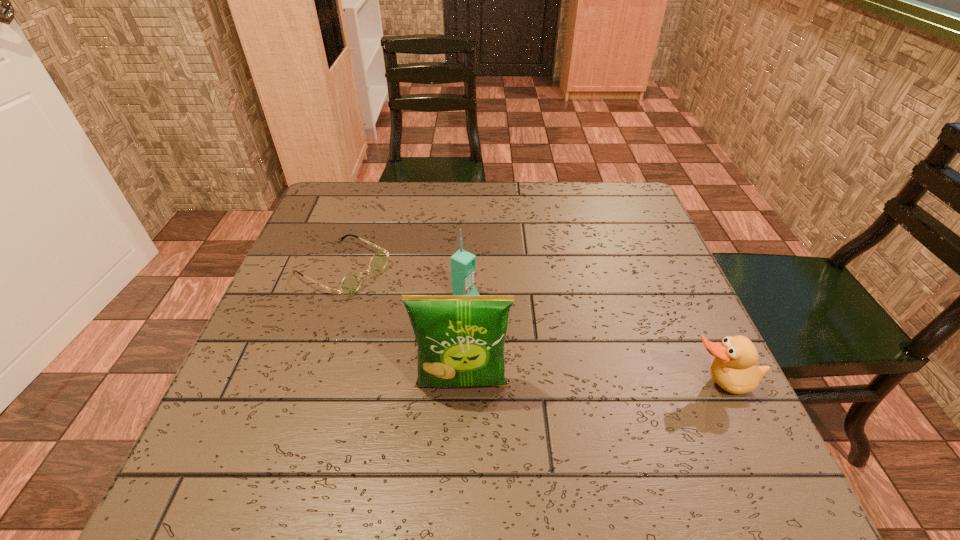
The height and width of the screenshot is (540, 960). Find the location of `free region at the left edge of the desktop`. free region at the left edge of the desktop is located at coordinates (316, 267).

Find the location of a particular element. This screenshot has height=540, width=960. vacant space at the right edge of the desktop is located at coordinates (637, 284).

I want to click on vacant area at the far left corner, so click(349, 212).

Image resolution: width=960 pixels, height=540 pixels. In order to click on vacant space at the near left corner of the desktop in this screenshot , I will do `click(271, 416)`.

Where is `vacant space at the far right corner of the desktop`? This screenshot has width=960, height=540. vacant space at the far right corner of the desktop is located at coordinates (586, 210).

This screenshot has height=540, width=960. What are the coordinates of `vacant space that's between the third shortest object and the duck` in the screenshot? It's located at (592, 342).

This screenshot has height=540, width=960. Identify the location of free space that is in between the shortest object and the crisp (potato chip). (402, 327).

The image size is (960, 540). I want to click on free space between the third shortest object and the shortest object, so click(404, 284).

Locate an element on the screen. This screenshot has width=960, height=540. blank region between the second shortest object and the leftmost object is located at coordinates (530, 327).

Locate an element on the screen. vacant space that's between the rightmost object and the cellular telephone is located at coordinates (592, 342).